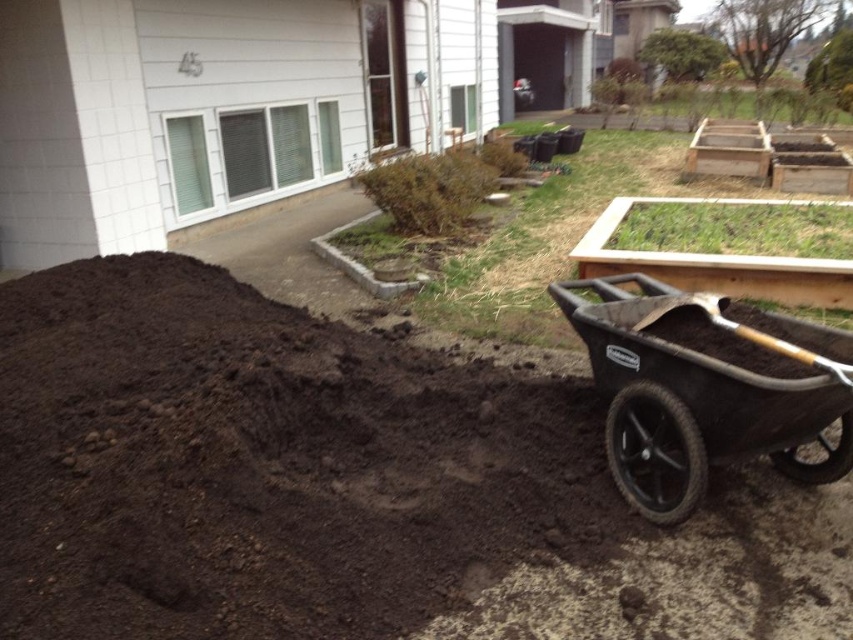
Is point (9, 556) less distant than point (664, 307)?

Yes, point (9, 556) is in front of point (664, 307).

Can you confirm if dark brown soil at center is smaller than wooden shovel at lower right?

Actually, dark brown soil at center might be larger than wooden shovel at lower right.

The height and width of the screenshot is (640, 853). What do you see at coordinates (347, 484) in the screenshot?
I see `dark brown soil at center` at bounding box center [347, 484].

At what (x,y) coordinates should I click in order to perform the action: click on dark brown soil at center. Please return your answer as a coordinate pair (x, y). Looking at the image, I should click on (347, 484).

Can you confirm if dark brown soil at center is positioned to the left of black rubber wheelbarrow at lower right?

Indeed, dark brown soil at center is positioned on the left side of black rubber wheelbarrow at lower right.

Is dark brown soil at center closer to the viewer compared to black rubber wheelbarrow at lower right?

Yes.

Who is more forward, (12,531) or (724,381)?

Point (12,531) is more forward.

Locate an element on the screen. dark brown soil at center is located at coordinates (347, 484).

How much distance is there between black rubber wheelbarrow at lower right and wooden shovel at lower right?

8.28 inches

The height and width of the screenshot is (640, 853). I want to click on black rubber wheelbarrow at lower right, so click(706, 388).

Where is `black rubber wheelbarrow at lower right`? The width and height of the screenshot is (853, 640). black rubber wheelbarrow at lower right is located at coordinates (706, 388).

At what (x,y) coordinates should I click in order to perform the action: click on black rubber wheelbarrow at lower right. Please return your answer as a coordinate pair (x, y). The width and height of the screenshot is (853, 640). Looking at the image, I should click on (706, 388).